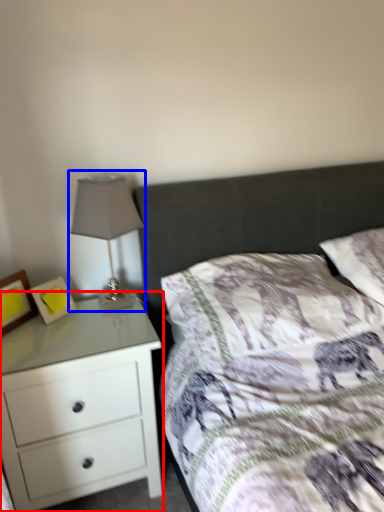
Question: Which object appears closest to the camera in this image, chest of drawers (highlighted by a red box) or table lamp (highlighted by a blue box)?

Choices:
 (A) chest of drawers
 (B) table lamp

Answer: (A)